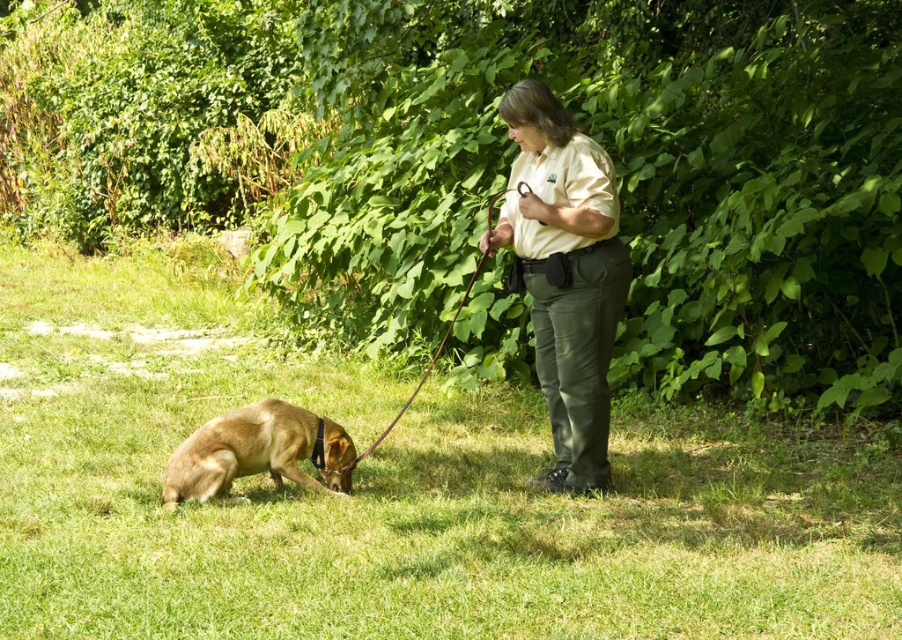
Question: Which of these objects is positioned closest to the green grass at lower center?

Choices:
 (A) black leather leash at center
 (B) matte khaki shirt at center

Answer: (B)

Question: Does matte khaki shirt at center have a greater width compared to brown matte dog at lower left?

Choices:
 (A) no
 (B) yes

Answer: (A)

Question: Estimate the real-world distances between objects in this image. Which object is closer to the matte khaki shirt at center?

Choices:
 (A) green grass at lower center
 (B) brown matte dog at lower left
 (C) black leather leash at center

Answer: (B)

Question: Which point is farther from the camera taking this photo?

Choices:
 (A) (511, 192)
 (B) (327, 449)
 (C) (613, 269)

Answer: (B)

Question: Is green grass at lower center to the left of matte khaki shirt at center from the viewer's perspective?

Choices:
 (A) no
 (B) yes

Answer: (B)

Question: Can you confirm if green grass at lower center is positioned above brown matte dog at lower left?

Choices:
 (A) no
 (B) yes

Answer: (B)